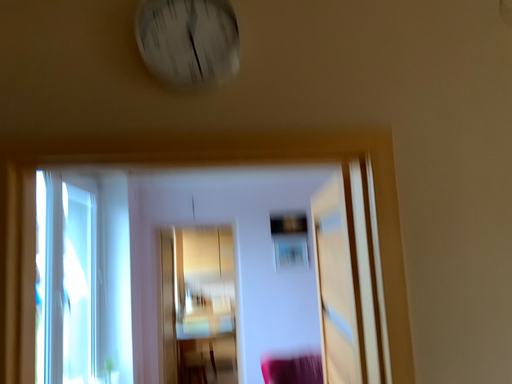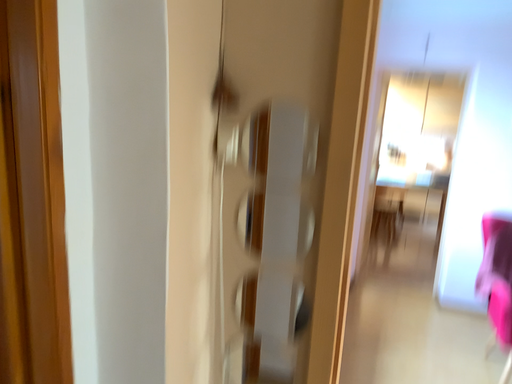
Question: Which way did the camera rotate in the video?

Choices:
 (A) rotated downward
 (B) rotated upward

Answer: (A)